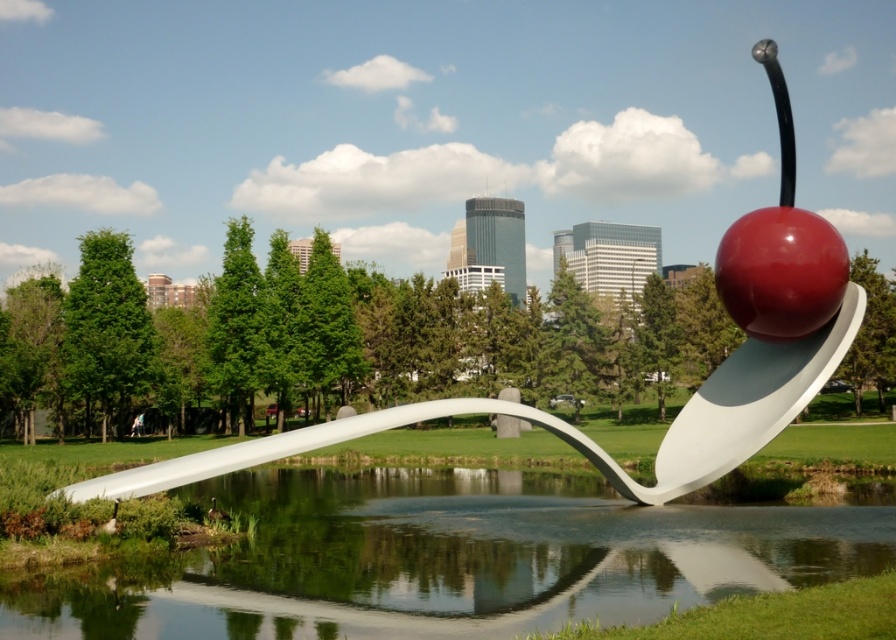
Question: Does transparent water at spoon center have a lesser width compared to white glossy spoon at center?

Choices:
 (A) yes
 (B) no

Answer: (A)

Question: Is white glossy spoon at center thinner than glossy red cherry at upper right?

Choices:
 (A) yes
 (B) no

Answer: (B)

Question: Among these objects, which one is farthest from the camera?

Choices:
 (A) glossy red cherry at upper right
 (B) white glossy spoon at center
 (C) transparent water at spoon center

Answer: (A)

Question: Based on their relative distances, which object is nearer to the glossy red cherry at upper right?

Choices:
 (A) transparent water at spoon center
 (B) white glossy spoon at center

Answer: (B)

Question: Is white glossy spoon at center bigger than glossy red cherry at upper right?

Choices:
 (A) yes
 (B) no

Answer: (A)

Question: Which is farther from the white glossy spoon at center?

Choices:
 (A) glossy red cherry at upper right
 (B) transparent water at spoon center

Answer: (B)